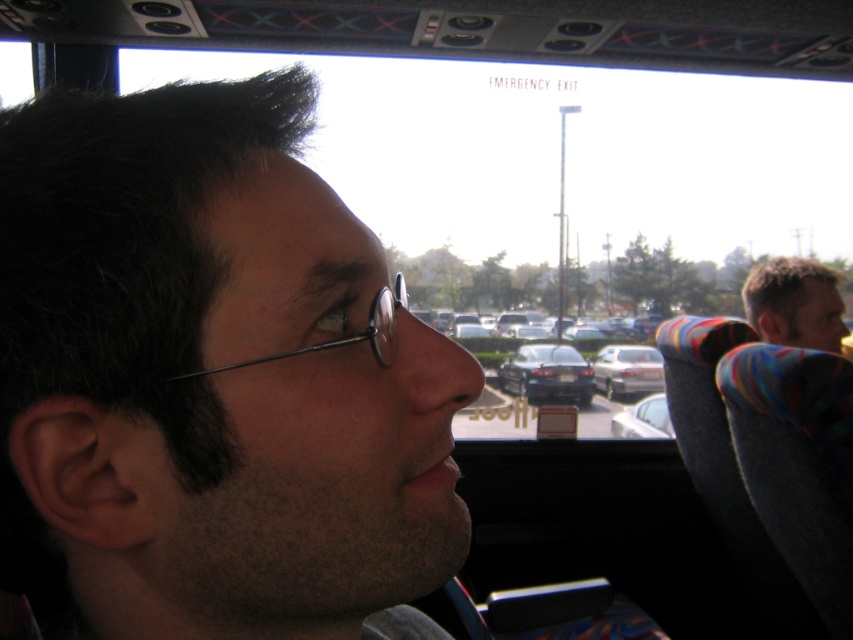
Which is more to the right, dark hair at left or white glossy car at center?

From the viewer's perspective, white glossy car at center appears more on the right side.

Does dark hair at left have a lesser height compared to white glossy car at center?

Incorrect, dark hair at left's height does not fall short of white glossy car at center's.

Find the location of a particular element. dark hair at left is located at coordinates (212, 378).

You are a GUI agent. You are given a task and a screenshot of the screen. Output one action in this format:
    pyautogui.click(x=<x>, y=<y>)
    Task: Click on the dark hair at left
    
    Given the screenshot: What is the action you would take?
    pyautogui.click(x=212, y=378)

Does matte black car at center have a lesser width compared to semi-transparent plastic glasses at center?

In fact, matte black car at center might be wider than semi-transparent plastic glasses at center.

Who is taller, matte black car at center or semi-transparent plastic glasses at center?

With more height is matte black car at center.

Is point (532, 372) closer to camera compared to point (405, 305)?

No, (532, 372) is further to viewer.

What are the coordinates of `matte black car at center` in the screenshot? It's located at [547, 374].

Can you confirm if blonde hair at right is positioned to the left of semi-transparent plastic glasses at center?

Incorrect, blonde hair at right is not on the left side of semi-transparent plastic glasses at center.

I want to click on blonde hair at right, so click(795, 304).